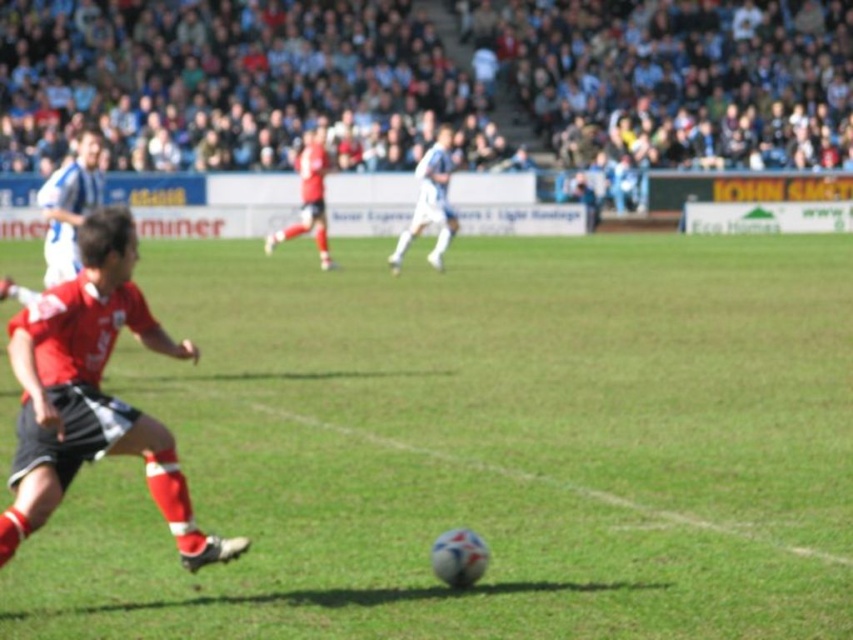
Can you confirm if green grass football field at center is positioned to the left of red matte jersey at center?

Incorrect, green grass football field at center is not on the left side of red matte jersey at center.

Who is higher up, green grass football field at center or red matte jersey at center?

red matte jersey at center

Locate an element on the screen. green grass football field at center is located at coordinates (479, 445).

In order to click on green grass football field at center in this screenshot , I will do `click(479, 445)`.

Who is positioned more to the left, green grass football field at center or matte red jersey at center?

From the viewer's perspective, matte red jersey at center appears more on the left side.

Describe the element at coordinates (479, 445) in the screenshot. I see `green grass football field at center` at that location.

The image size is (853, 640). What do you see at coordinates (479, 445) in the screenshot? I see `green grass football field at center` at bounding box center [479, 445].

Find the location of `green grass football field at center`. green grass football field at center is located at coordinates (479, 445).

Who is more distant from viewer, (335, 563) or (450, 163)?

The point (450, 163) is more distant.

Is green grass football field at center thinner than white matte soccer player at center?

In fact, green grass football field at center might be wider than white matte soccer player at center.

Where is `green grass football field at center`? The height and width of the screenshot is (640, 853). green grass football field at center is located at coordinates (479, 445).

Identify the location of green grass football field at center. (479, 445).